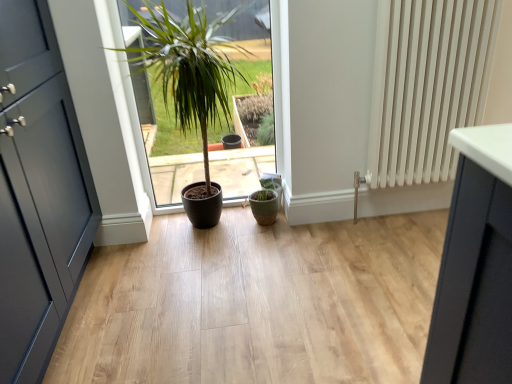
What do you see at coordinates (264, 206) in the screenshot? I see `matte green flowerpot at center` at bounding box center [264, 206].

At what (x,y) coordinates should I click in order to perform the action: click on matte dark blue door at left. Please return your answer as a coordinate pair (x, y). The width and height of the screenshot is (512, 384). Looking at the image, I should click on (38, 192).

Can you confirm if white ribbed radiator at right is thinner than matte brown pot at center?

Correct, the width of white ribbed radiator at right is less than that of matte brown pot at center.

Is white ribbed radiator at right inside the boundaries of matte brown pot at center, or outside?

white ribbed radiator at right cannot be found inside matte brown pot at center.

Is white ribbed radiator at right taller or shorter than matte brown pot at center?

white ribbed radiator at right is shorter than matte brown pot at center.

From the image's perspective, which is above, matte brown pot at center or matte green flowerpot at center?

matte brown pot at center is shown above in the image.

Would you say matte brown pot at center is a long distance from matte green flowerpot at center?

matte brown pot at center is near matte green flowerpot at center, not far away.

From a real-world perspective, is matte brown pot at center positioned above or below matte green flowerpot at center?

Clearly, from a real-world perspective, matte brown pot at center is above matte green flowerpot at center.

Is matte brown pot at center surrounding matte green flowerpot at center?

Yes, matte brown pot at center is surrounding matte green flowerpot at center.

Which is in front, point (24, 65) or point (272, 202)?

Point (24, 65)

Considering the relative positions of matte dark blue door at left and matte green flowerpot at center in the image provided, is matte dark blue door at left to the right of matte green flowerpot at center from the viewer's perspective?

In fact, matte dark blue door at left is to the left of matte green flowerpot at center.

From the image's perspective, does matte dark blue door at left appear lower than matte green flowerpot at center?

No, from the image's perspective, matte dark blue door at left is not beneath matte green flowerpot at center.

Considering the relative sizes of matte dark blue door at left and matte green flowerpot at center in the image provided, is matte dark blue door at left bigger than matte green flowerpot at center?

Yes, matte dark blue door at left is bigger than matte green flowerpot at center.

Find the location of a particular element. flowerpot on the left of white ribbed radiator at right is located at coordinates (264, 206).

Which is in front, point (463, 113) or point (258, 208)?

Positioned in front is point (463, 113).

How different are the orientations of white ribbed radiator at right and matte green flowerpot at center in degrees?

1.72 degrees separate the facing orientations of white ribbed radiator at right and matte green flowerpot at center.

Can you confirm if white ribbed radiator at right is positioned to the left of matte green flowerpot at center?

In fact, white ribbed radiator at right is to the right of matte green flowerpot at center.

Which of these two, matte green flowerpot at center or white ribbed radiator at right, stands taller?

With more height is white ribbed radiator at right.

Where is `radiator in front of the matte green flowerpot at center`? This screenshot has height=384, width=512. radiator in front of the matte green flowerpot at center is located at coordinates (426, 85).

From a real-world perspective, which is physically above, matte green flowerpot at center or white ribbed radiator at right?

In real-world perspective, white ribbed radiator at right is above.

Is white ribbed radiator at right completely or partially inside matte green flowerpot at center?

That's incorrect, white ribbed radiator at right is not inside matte green flowerpot at center.

Is matte green flowerpot at center placed right next to matte brown pot at center?

No, matte green flowerpot at center is not touching matte brown pot at center.

How much distance is there between matte green flowerpot at center and matte brown pot at center?

matte green flowerpot at center and matte brown pot at center are 25.95 inches apart from each other.

Who is bigger, matte green flowerpot at center or matte brown pot at center?

With larger size is matte brown pot at center.

From the image's perspective, who appears lower, matte green flowerpot at center or matte brown pot at center?

matte green flowerpot at center, from the image's perspective.

From the picture: Does white ribbed radiator at right have a greater width compared to matte dark blue door at left?

No, white ribbed radiator at right is not wider than matte dark blue door at left.

Is matte dark blue door at left inside white ribbed radiator at right?

No, matte dark blue door at left is not a part of white ribbed radiator at right.

Considering the positions of objects white ribbed radiator at right and matte dark blue door at left in the image provided, who is more to the right, white ribbed radiator at right or matte dark blue door at left?

From the viewer's perspective, white ribbed radiator at right appears more on the right side.

Which is in front, white ribbed radiator at right or matte dark blue door at left?

Positioned in front is matte dark blue door at left.

Where is `houseplant that appears on the left of white ribbed radiator at right`? houseplant that appears on the left of white ribbed radiator at right is located at coordinates (189, 67).

The height and width of the screenshot is (384, 512). I want to click on houseplant above the matte green flowerpot at center (from a real-world perspective), so click(189, 67).

When comparing their distances from matte green flowerpot at center, does matte dark blue door at left or matte brown pot at center seem closer?

matte brown pot at center is closer to matte green flowerpot at center.

When comparing their distances from matte brown pot at center, does matte green flowerpot at center or white ribbed radiator at right seem further?

white ribbed radiator at right lies further to matte brown pot at center than the other object.

Based on their spatial positions, is matte green flowerpot at center or matte brown pot at center further from white ribbed radiator at right?

matte green flowerpot at center is further to white ribbed radiator at right.

From the picture: From the image, which object appears to be nearer to matte brown pot at center, white ribbed radiator at right or matte green flowerpot at center?

Based on the image, matte green flowerpot at center appears to be nearer to matte brown pot at center.

Which object lies further to the anchor point white ribbed radiator at right, matte brown pot at center or matte green flowerpot at center?

Based on the image, matte green flowerpot at center appears to be further to white ribbed radiator at right.

Based on their spatial positions, is white ribbed radiator at right or matte brown pot at center closer to matte green flowerpot at center?

Based on the image, matte brown pot at center appears to be nearer to matte green flowerpot at center.

Which object lies nearer to the anchor point matte green flowerpot at center, matte dark blue door at left or white ribbed radiator at right?

The object closer to matte green flowerpot at center is white ribbed radiator at right.

Based on their spatial positions, is matte green flowerpot at center or white ribbed radiator at right further from matte dark blue door at left?

Among the two, white ribbed radiator at right is located further to matte dark blue door at left.

Where is `houseplant between matte dark blue door at left and matte green flowerpot at center in the front-back direction`? The width and height of the screenshot is (512, 384). houseplant between matte dark blue door at left and matte green flowerpot at center in the front-back direction is located at coordinates (189, 67).

Image resolution: width=512 pixels, height=384 pixels. I want to click on flowerpot between matte brown pot at center and white ribbed radiator at right in the horizontal direction, so click(264, 206).

Identify the location of houseplant located between matte dark blue door at left and white ribbed radiator at right in the left-right direction. The height and width of the screenshot is (384, 512). (189, 67).

At what (x,y) coordinates should I click in order to perform the action: click on flowerpot between matte dark blue door at left and white ribbed radiator at right. Please return your answer as a coordinate pair (x, y). Looking at the image, I should click on (264, 206).